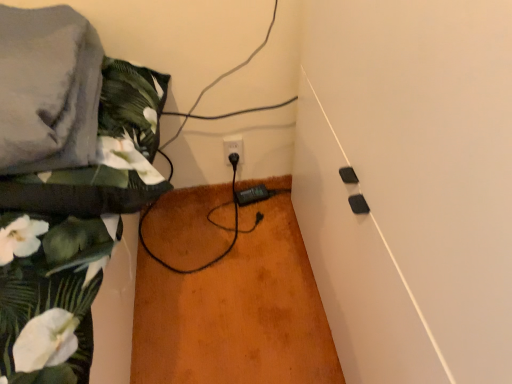
Question: Is black plastic socket at center in front of or behind gray fabric at upper left in the image?

Choices:
 (A) front
 (B) behind

Answer: (B)

Question: Would you say black plastic socket at center is to the left or to the right of gray fabric at upper left in the picture?

Choices:
 (A) right
 (B) left

Answer: (A)

Question: Which is farther from the floral fabric at left?

Choices:
 (A) gray fabric at upper left
 (B) black plastic socket at center

Answer: (B)

Question: Considering the real-world distances, which object is farthest from the floral fabric at left?

Choices:
 (A) gray fabric at upper left
 (B) black plastic socket at center

Answer: (B)